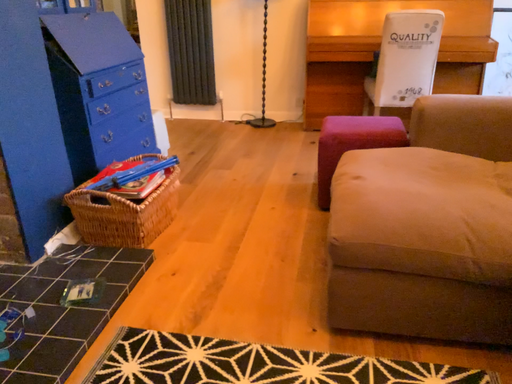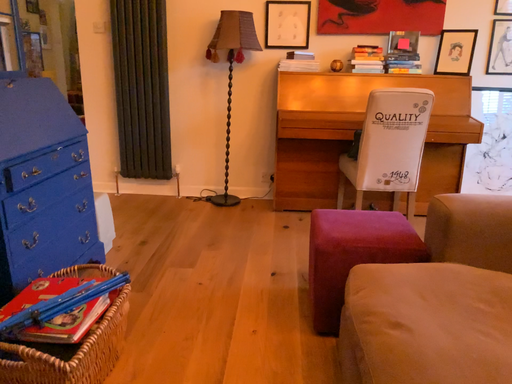
Question: How did the camera likely rotate when shooting the video?

Choices:
 (A) rotated left
 (B) rotated right

Answer: (B)